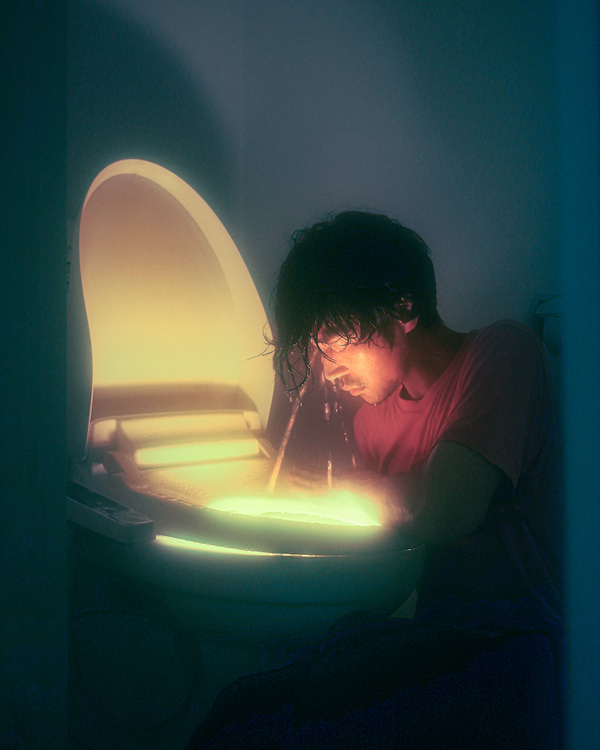
Locate an element on the screen. This screenshot has width=600, height=750. toilet bowl is located at coordinates (250, 612).